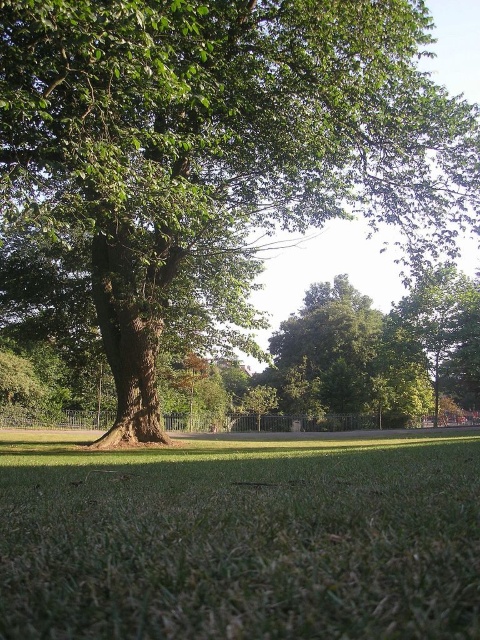
You are standing in the park and see the green leafy tree at center and the green leafy tree at upper right. Which tree is positioned higher in the image?

The green leafy tree at center is positioned higher in the image than the green leafy tree at upper right.

You are standing at the center of the park and want to take a photo of the green leafy tree at center. According to the coordinates provided, where should you position yourself to ensure the tree is centered in your camera view?

To center the green leafy tree at center in your camera view, position yourself so that the tree is located at the coordinates point (x=218, y=141).

You are standing in the park and see the green leafy tree at center and the green grassy at center. Which object is positioned to the right side of the other?

The green leafy tree at center is to the right of green grassy at center.